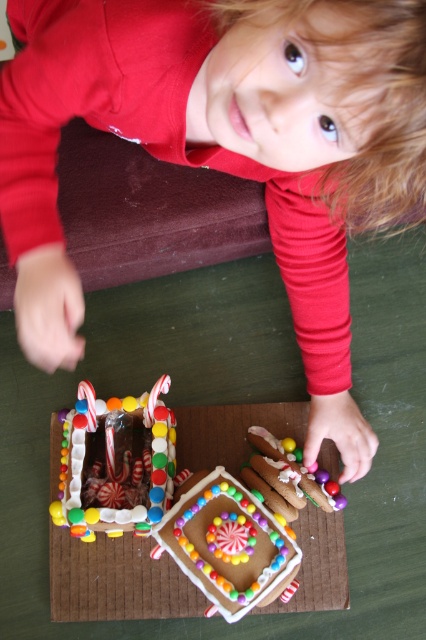
Is glossy chocolate cake at center smaller than glossy icing gingerbread house at center?

Actually, glossy chocolate cake at center might be larger than glossy icing gingerbread house at center.

Does point (80, 506) lie behind point (196, 529)?

Yes.

Identify the location of glossy chocolate cake at center. The height and width of the screenshot is (640, 426). (115, 461).